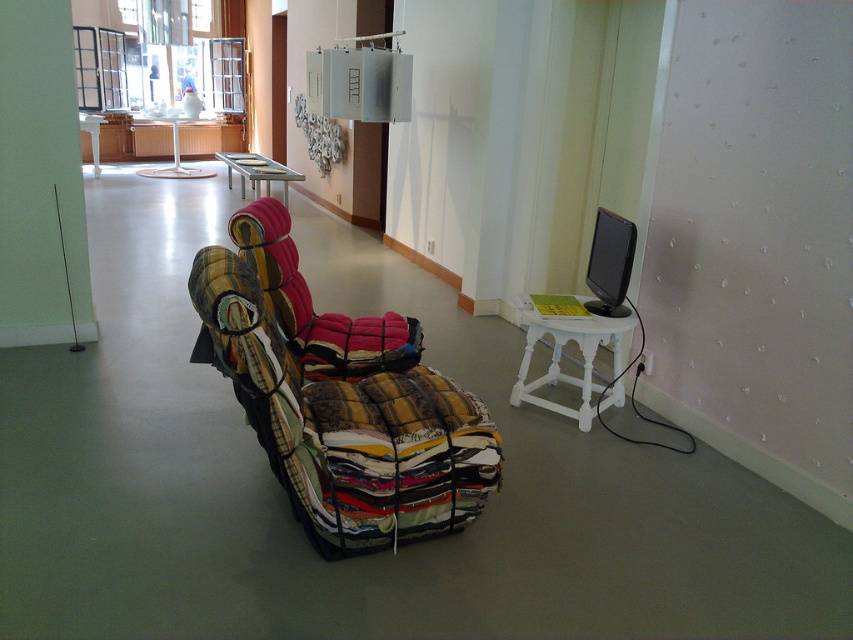
Is patchwork fabric chair at center further to the viewer compared to white wooden stool at right?

That is False.

Who is positioned more to the left, patchwork fabric chair at center or white wooden stool at right?

Positioned to the left is patchwork fabric chair at center.

Find the location of a particular element. This screenshot has width=853, height=640. patchwork fabric chair at center is located at coordinates (345, 426).

Can you confirm if white wooden stool at right is taller than metallic silver table at upper center?

Incorrect, white wooden stool at right's height is not larger of metallic silver table at upper center's.

Does white wooden stool at right come in front of metallic silver table at upper center?

Yes, white wooden stool at right is closer to the viewer.

Is point (619, 358) positioned in front of point (241, 177)?

That is True.

Locate an element on the screen. This screenshot has width=853, height=640. white wooden stool at right is located at coordinates (582, 362).

Can you confirm if multicolored patchwork swivel chair at center is smaller than white wooden stool at right?

No.

Where is `multicolored patchwork swivel chair at center`? multicolored patchwork swivel chair at center is located at coordinates (312, 307).

The width and height of the screenshot is (853, 640). In order to click on multicolored patchwork swivel chair at center in this screenshot , I will do `click(312, 307)`.